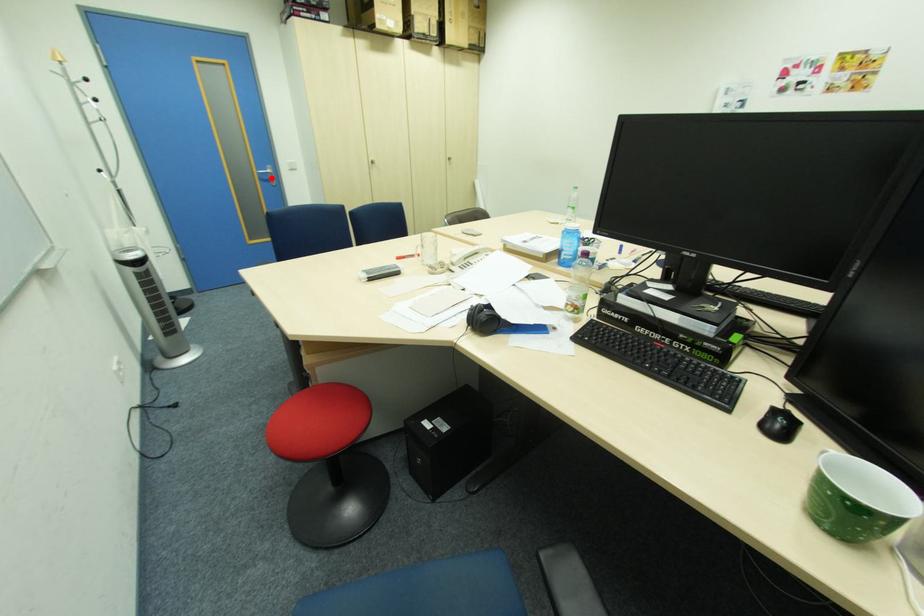
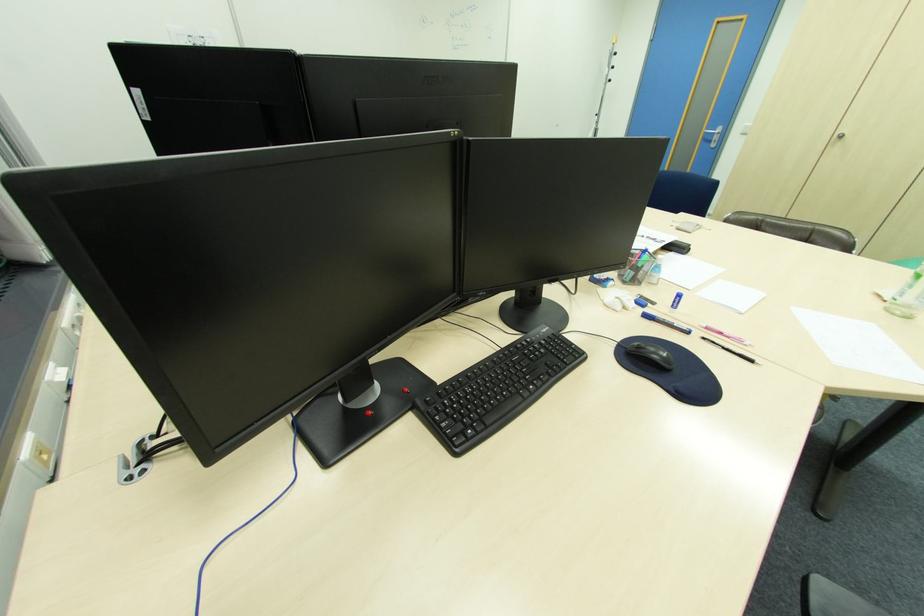
Locate, in the second image, the point that corresponds to the highlighted location in the first image.

(713, 139)